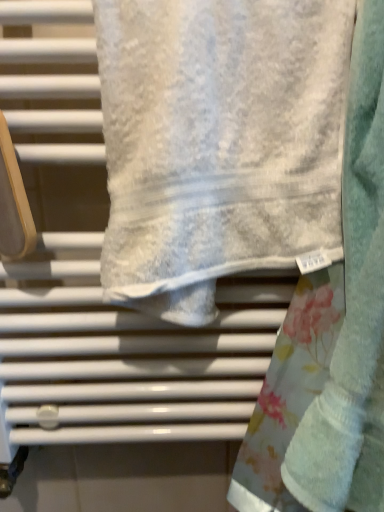
Question: Is fluffy white towel at center, which appears as the second towel when viewed from the left, spatially inside white textured towel at center, the 1th towel when ordered from left to right, or outside of it?

Choices:
 (A) outside
 (B) inside

Answer: (A)

Question: Considering the positions of fluffy white towel at center, which appears as the second towel when viewed from the left, and white textured towel at center, the 1th towel when ordered from left to right, in the image, is fluffy white towel at center, which appears as the second towel when viewed from the left, taller or shorter than white textured towel at center, the 1th towel when ordered from left to right,?

Choices:
 (A) short
 (B) tall

Answer: (B)

Question: Relative to white textured towel at center, the 1th towel when ordered from left to right, is fluffy white towel at center, the 1th towel positioned from the right, in front or behind?

Choices:
 (A) behind
 (B) front

Answer: (B)

Question: Looking at their shapes, would you say white textured towel at center, the 1th towel when ordered from left to right, is wider or thinner than fluffy white towel at center, which appears as the second towel when viewed from the left?

Choices:
 (A) wide
 (B) thin

Answer: (B)

Question: From a real-world perspective, relative to fluffy white towel at center, which appears as the second towel when viewed from the left, is white textured towel at center, placed as the 2th towel when sorted from right to left, vertically above or below?

Choices:
 (A) above
 (B) below

Answer: (A)

Question: Is point (241, 67) closer or farther from the camera than point (365, 267)?

Choices:
 (A) farther
 (B) closer

Answer: (B)

Question: Considering the positions of white textured towel at center, placed as the 2th towel when sorted from right to left, and fluffy white towel at center, the 1th towel positioned from the right, in the image, is white textured towel at center, placed as the 2th towel when sorted from right to left, taller or shorter than fluffy white towel at center, the 1th towel positioned from the right,?

Choices:
 (A) tall
 (B) short

Answer: (B)